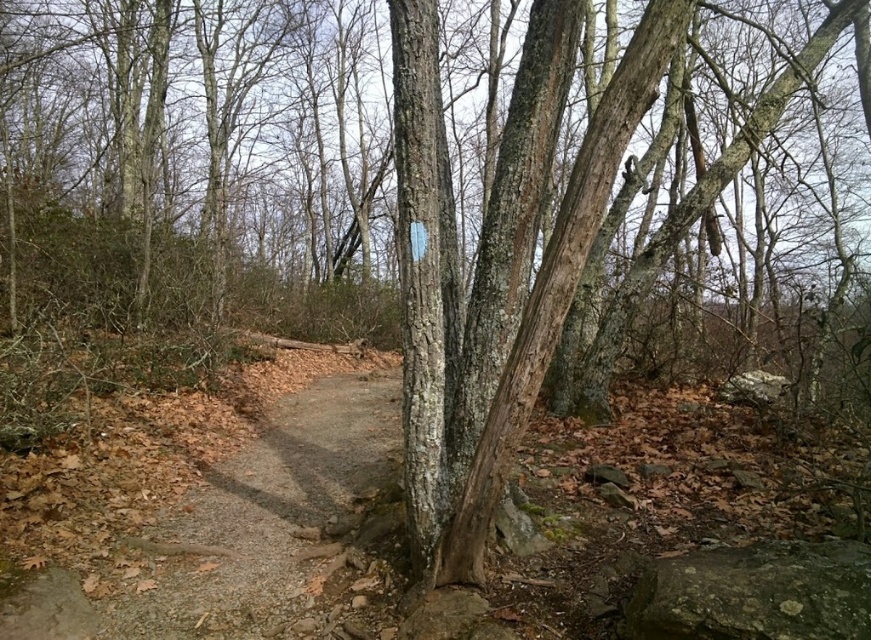
From the picture: You are a hiker trying to navigate through the forest path. You see a smooth bark tree at center and a gray rough rock at lower right. Which object is wider?

The smooth bark tree at center is wider than the gray rough rock at lower right.